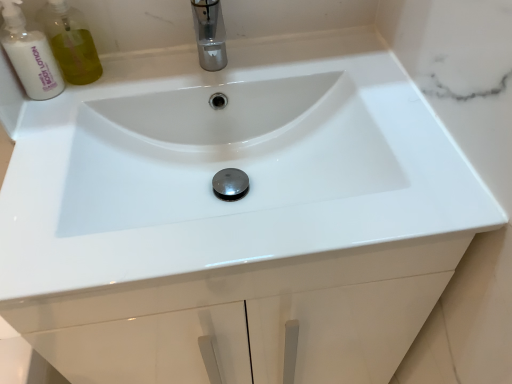
Locate an element on the screen. The image size is (512, 384). vacant area that is in front of white lotion at upper left is located at coordinates (42, 139).